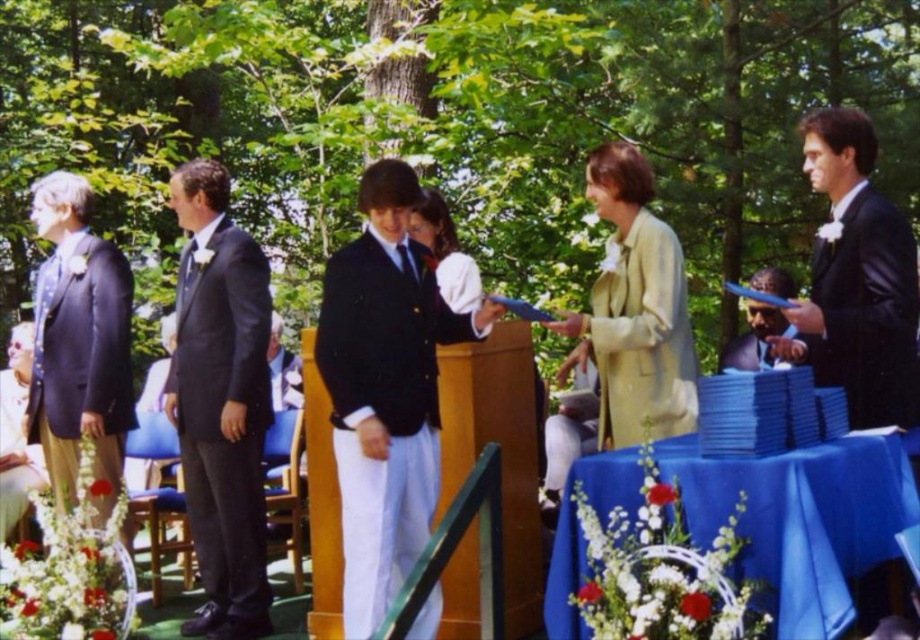
You are a photographer at this event. You need to adjust your camera angle so that both the black leather suit at right and the white satin dress at center appear in the frame. Considering their heights, which subject should you focus on to ensure both are fully visible?

The black leather suit at right is much taller than the white satin dress at center, so you should focus on the black leather suit at right to ensure both are fully visible by adjusting the camera angle to capture the taller subject first.

Looking at this image, you are an event organizer and you see the black satin suit at left and the matte black suit at left at the event. Which one is positioned more to the right?

The black satin suit at left is positioned to the right of the matte black suit at left.